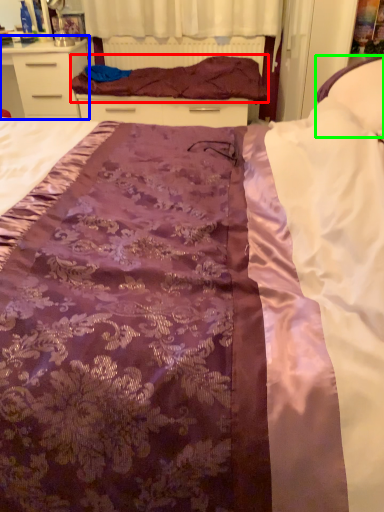
Question: Based on their relative distances, which object is farther from blanket (highlighted by a red box)? Choose from chest of drawers (highlighted by a blue box) and pillow (highlighted by a green box).

Choices:
 (A) chest of drawers
 (B) pillow

Answer: (B)